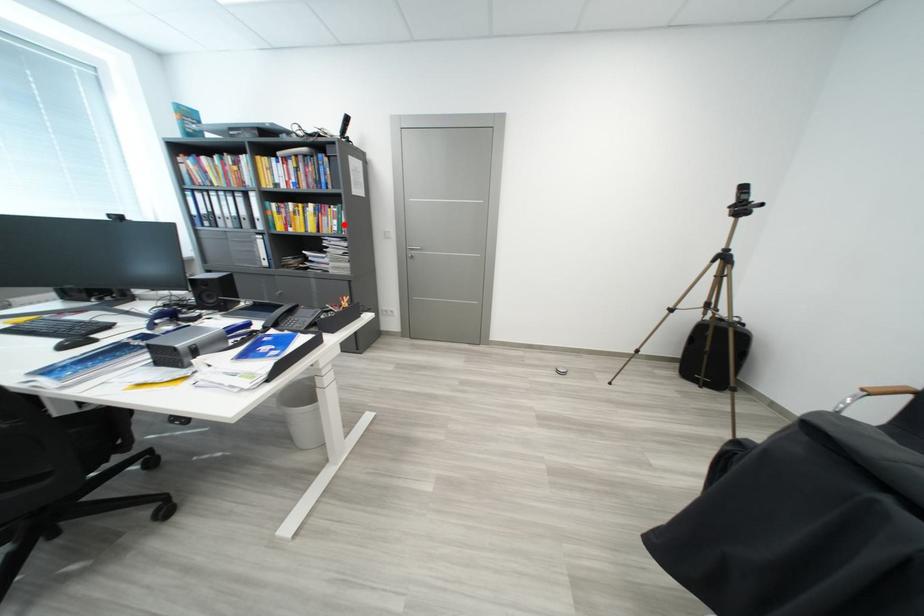
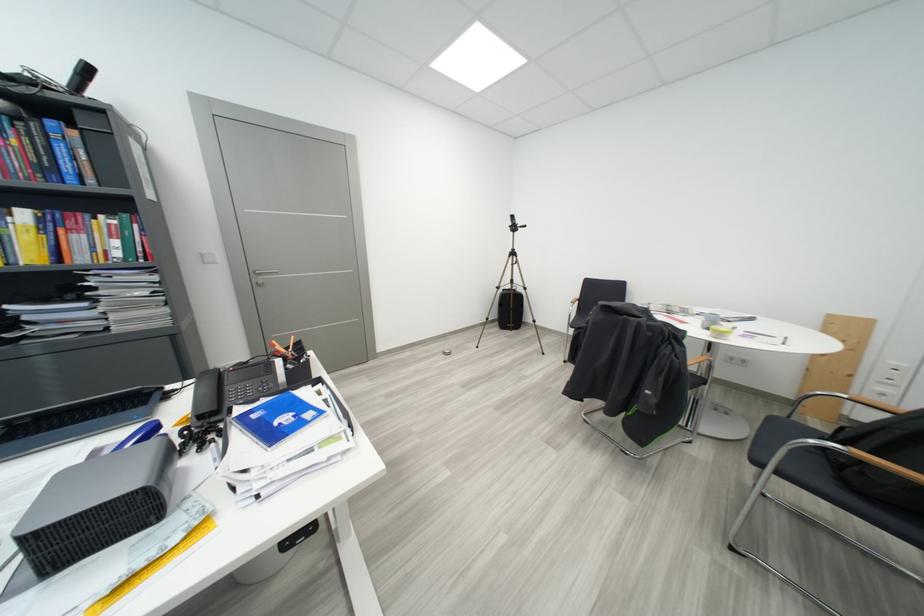
Find the pixel in the second image that matches the highlighted location in the first image.

(126, 245)